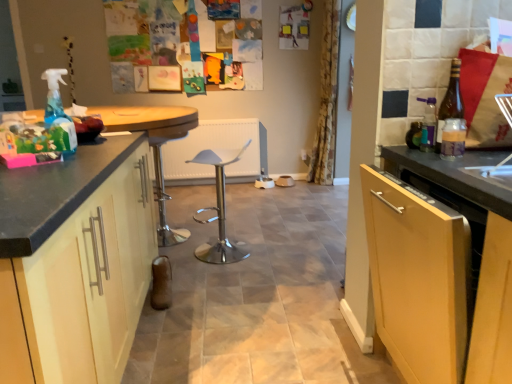
Question: Could you tell me if yellow floral fabric curtain at center is facing brown glass bottle at right, the 1th bottle in the back-to-front sequence?

Choices:
 (A) yes
 (B) no

Answer: (B)

Question: Can brown glass bottle at right, the 1th bottle in the back-to-front sequence, be found inside yellow floral fabric curtain at center?

Choices:
 (A) no
 (B) yes

Answer: (A)

Question: Is yellow floral fabric curtain at center not inside brown glass bottle at right, which is counted as the second bottle, starting from the front?

Choices:
 (A) no
 (B) yes

Answer: (B)

Question: From the image's perspective, is yellow floral fabric curtain at center below brown glass bottle at right, the 1th bottle in the back-to-front sequence?

Choices:
 (A) yes
 (B) no

Answer: (B)

Question: Considering the relative sizes of yellow floral fabric curtain at center and brown glass bottle at right, the 1th bottle in the back-to-front sequence, in the image provided, is yellow floral fabric curtain at center smaller than brown glass bottle at right, the 1th bottle in the back-to-front sequence,?

Choices:
 (A) yes
 (B) no

Answer: (B)

Question: Does yellow floral fabric curtain at center have a larger size compared to brown glass bottle at right, the 1th bottle in the back-to-front sequence?

Choices:
 (A) yes
 (B) no

Answer: (A)

Question: Can you confirm if polished silver bar stool at center, acting as the 2th bar stool starting from the left, is wider than polished chrome bar stool at center, placed as the 2th bar stool when sorted from right to left?

Choices:
 (A) no
 (B) yes

Answer: (B)

Question: Is polished silver bar stool at center, acting as the 2th bar stool starting from the left, in contact with polished chrome bar stool at center, the 1th bar stool from the left?

Choices:
 (A) no
 (B) yes

Answer: (A)

Question: Is polished silver bar stool at center, acting as the 2th bar stool starting from the left, positioned behind polished chrome bar stool at center, placed as the 2th bar stool when sorted from right to left?

Choices:
 (A) yes
 (B) no

Answer: (B)

Question: From the image's perspective, is polished silver bar stool at center, acting as the 2th bar stool starting from the left, beneath polished chrome bar stool at center, the 1th bar stool from the left?

Choices:
 (A) no
 (B) yes

Answer: (B)

Question: Is polished silver bar stool at center, positioned as the 1th bar stool in right-to-left order, thinner than polished chrome bar stool at center, placed as the 2th bar stool when sorted from right to left?

Choices:
 (A) no
 (B) yes

Answer: (A)

Question: Are polished silver bar stool at center, acting as the 2th bar stool starting from the left, and polished chrome bar stool at center, placed as the 2th bar stool when sorted from right to left, located far from each other?

Choices:
 (A) no
 (B) yes

Answer: (A)

Question: Is brown glass bottle at right, which is counted as the second bottle, starting from the front, turned away from yellow floral fabric curtain at center?

Choices:
 (A) yes
 (B) no

Answer: (B)